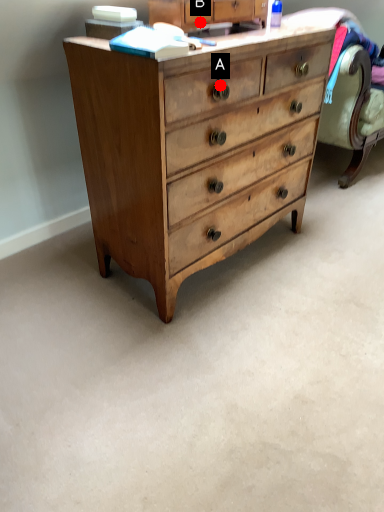
Question: Two points are circled on the image, labeled by A and B beside each circle. Which point is further to the camera?

Choices:
 (A) A is further
 (B) B is further

Answer: (B)